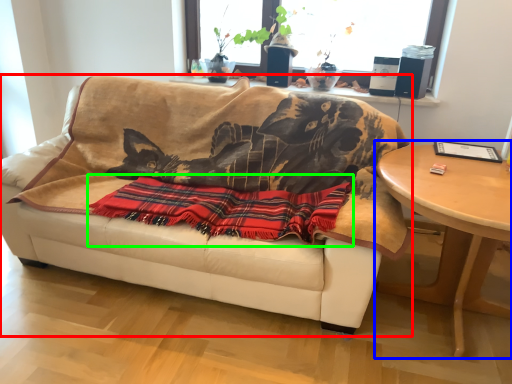
Question: Considering the real-world distances, which object is farthest from studio couch (highlighted by a red box)? table (highlighted by a blue box) or blanket (highlighted by a green box)?

Choices:
 (A) table
 (B) blanket

Answer: (A)